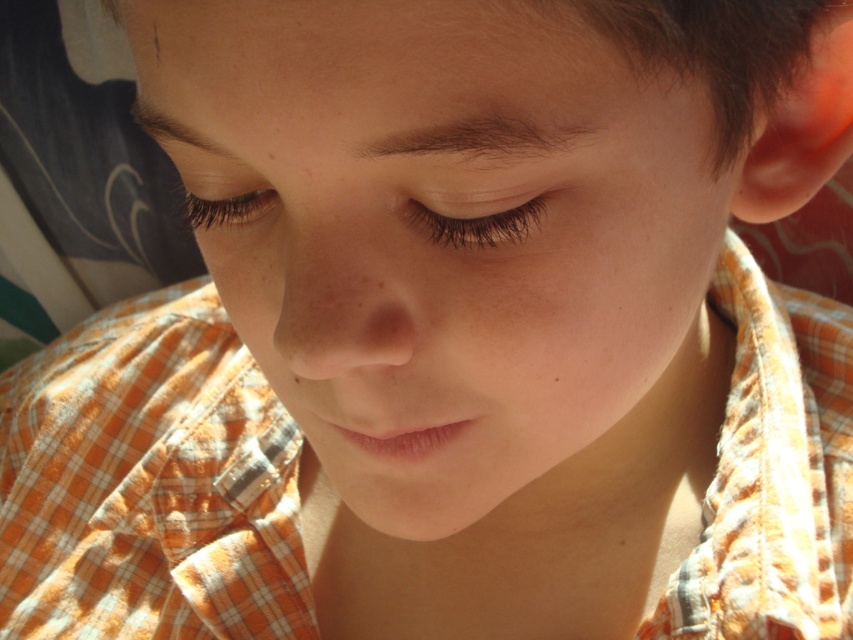
Question: Which point is farther to the camera?

Choices:
 (A) brown matte eyelashes at center
 (B) black eyelashes at upper left

Answer: (B)

Question: Can you confirm if brown matte eyelashes at center is positioned above black eyelashes at upper left?

Choices:
 (A) no
 (B) yes

Answer: (A)

Question: Which point is farther to the camera?

Choices:
 (A) (537, 208)
 (B) (195, 209)

Answer: (B)

Question: Which point is closer to the camera?

Choices:
 (A) brown matte eyelashes at center
 (B) black eyelashes at upper left

Answer: (A)

Question: Is brown matte eyelashes at center above black eyelashes at upper left?

Choices:
 (A) yes
 (B) no

Answer: (B)

Question: Can you confirm if brown matte eyelashes at center is positioned below black eyelashes at upper left?

Choices:
 (A) yes
 (B) no

Answer: (A)